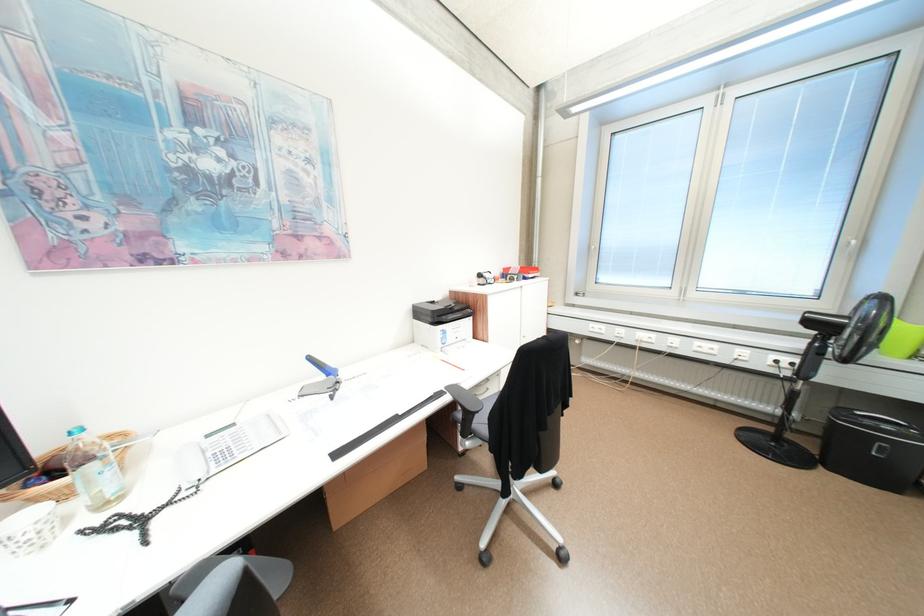
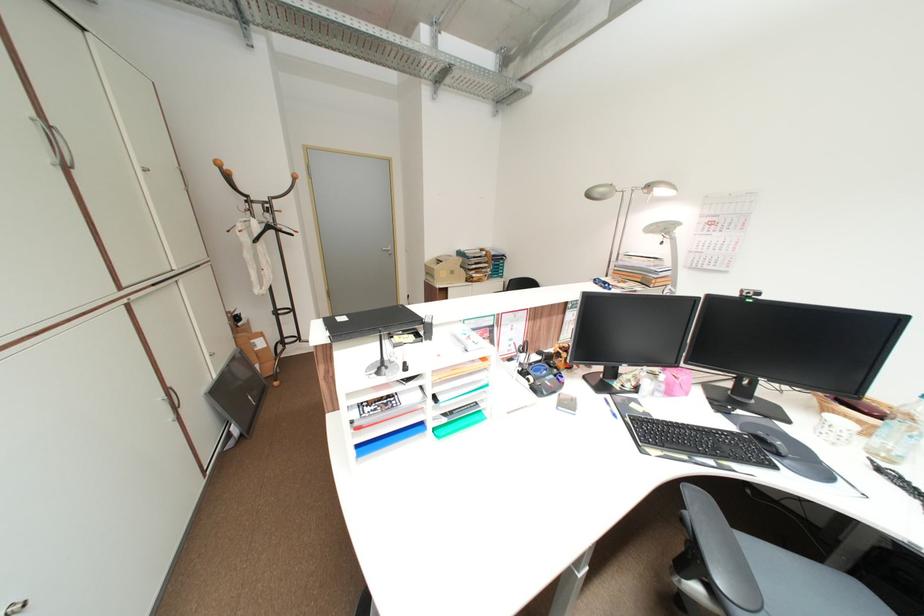
Based on the continuous images, in which direction is the camera rotating?

The camera rotated toward left-down.